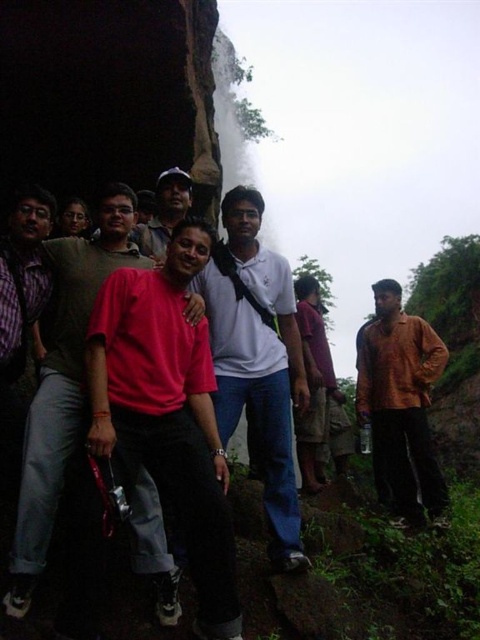
Question: Is bright red t-shirt at center wider than matte white shirt at center?

Choices:
 (A) yes
 (B) no

Answer: (A)

Question: Does white matte shirt at center come in front of matte brown shirt at right?

Choices:
 (A) no
 (B) yes

Answer: (B)

Question: Which point is closer to the camera?

Choices:
 (A) matte red shirt at center
 (B) matte white shirt at center

Answer: (A)

Question: Does bright red t-shirt at center appear on the left side of matte red shirt at center?

Choices:
 (A) yes
 (B) no

Answer: (B)

Question: Among these objects, which one is farthest from the camera?

Choices:
 (A) matte white shirt at center
 (B) purple cotton shirt at center
 (C) matte brown shirt at right

Answer: (A)

Question: Which point is farther to the camera?

Choices:
 (A) (173, 204)
 (B) (422, 486)
 (C) (320, 394)

Answer: (C)